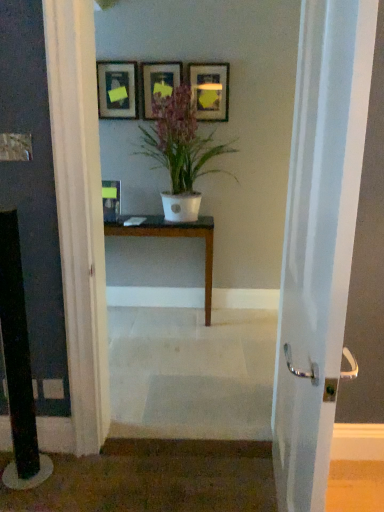
Question: From a real-world perspective, does white matte pot at center stand above dark brown wood table at center?

Choices:
 (A) yes
 (B) no

Answer: (A)

Question: Is dark brown wood table at center located within white matte pot at center?

Choices:
 (A) no
 (B) yes

Answer: (A)

Question: Is the surface of white matte pot at center in direct contact with dark brown wood table at center?

Choices:
 (A) yes
 (B) no

Answer: (B)

Question: Is white matte pot at center facing towards dark brown wood table at center?

Choices:
 (A) no
 (B) yes

Answer: (A)

Question: From the image's perspective, is white matte pot at center over dark brown wood table at center?

Choices:
 (A) yes
 (B) no

Answer: (A)

Question: From the image's perspective, is white matte pot at center beneath dark brown wood table at center?

Choices:
 (A) no
 (B) yes

Answer: (A)

Question: Can you confirm if white glossy door handle at center is taller than matte black picture frame at upper center, the 4th picture frame viewed from the left?

Choices:
 (A) yes
 (B) no

Answer: (A)

Question: Can you confirm if white glossy door handle at center is wider than matte black picture frame at upper center, the first picture frame when ordered from right to left?

Choices:
 (A) no
 (B) yes

Answer: (B)

Question: Can you confirm if white glossy door handle at center is thinner than matte black picture frame at upper center, the first picture frame when ordered from right to left?

Choices:
 (A) no
 (B) yes

Answer: (A)

Question: Is white glossy door handle at center in front of matte black picture frame at upper center, the first picture frame when ordered from right to left?

Choices:
 (A) no
 (B) yes

Answer: (B)

Question: Considering the relative sizes of white glossy door handle at center and matte black picture frame at upper center, the 4th picture frame viewed from the left, in the image provided, is white glossy door handle at center smaller than matte black picture frame at upper center, the 4th picture frame viewed from the left,?

Choices:
 (A) no
 (B) yes

Answer: (A)

Question: Is white glossy door handle at center far away from matte black picture frame at upper center, the 4th picture frame viewed from the left?

Choices:
 (A) no
 (B) yes

Answer: (B)

Question: From a real-world perspective, is dark brown wood table at center on matte black picture frame at center, which ranks as the first picture frame in left-to-right order?

Choices:
 (A) yes
 (B) no

Answer: (B)